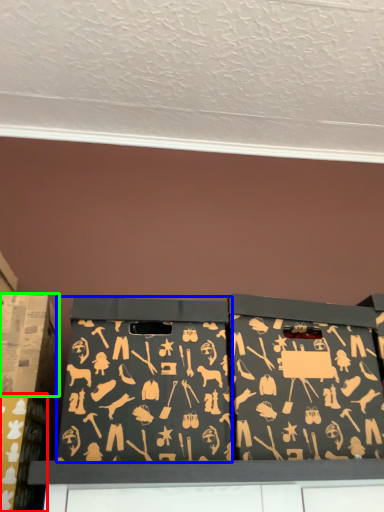
Question: Which object is the closest to the box (highlighted by a red box)? Choose among these: box (highlighted by a blue box) or box (highlighted by a green box).

Choices:
 (A) box
 (B) box

Answer: (B)